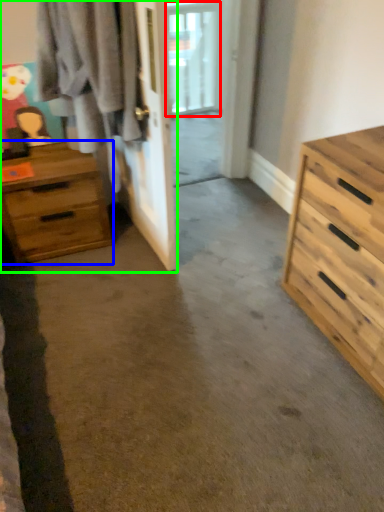
Question: Which is nearer to the window (highlighted by a red box)? chest of drawers (highlighted by a blue box) or closet (highlighted by a green box).

Choices:
 (A) chest of drawers
 (B) closet

Answer: (B)